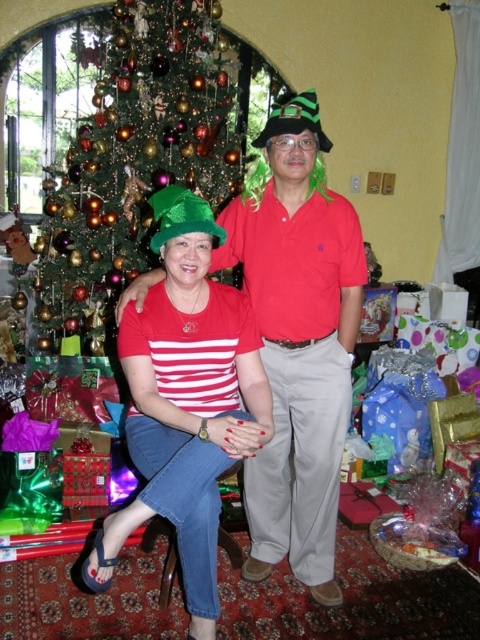
Does matte red shirt at center appear on the right side of shiny green christmas tree at left?

Correct, you'll find matte red shirt at center to the right of shiny green christmas tree at left.

Can you confirm if matte red shirt at center is taller than shiny green christmas tree at left?

In fact, matte red shirt at center may be shorter than shiny green christmas tree at left.

At what (x,y) coordinates should I click in order to perform the action: click on matte red shirt at center. Please return your answer as a coordinate pair (x, y). Looking at the image, I should click on 298,352.

At what (x,y) coordinates should I click in order to perform the action: click on matte red shirt at center. Please return your answer as a coordinate pair (x, y). This screenshot has height=640, width=480. Looking at the image, I should click on (298, 352).

Between point (184, 220) and point (296, 116), which one is positioned behind?

Point (296, 116)

Can you confirm if green felt hat at center is smaller than green felt hat at upper center?

Correct, green felt hat at center occupies less space than green felt hat at upper center.

Identify the location of green felt hat at center. This screenshot has width=480, height=640. (180, 216).

At what (x,y) coordinates should I click in order to perform the action: click on green felt hat at center. Please return your answer as a coordinate pair (x, y). This screenshot has height=640, width=480. Looking at the image, I should click on coord(180,216).

Which is in front, point (363, 278) or point (256, 436)?

Positioned in front is point (256, 436).

Does matte red shirt at center appear over matte green hat at center?

Indeed, matte red shirt at center is positioned over matte green hat at center.

Does point (292, 362) come behind point (195, 625)?

That is True.

This screenshot has height=640, width=480. What are the coordinates of `matte red shirt at center` in the screenshot? It's located at (298, 352).